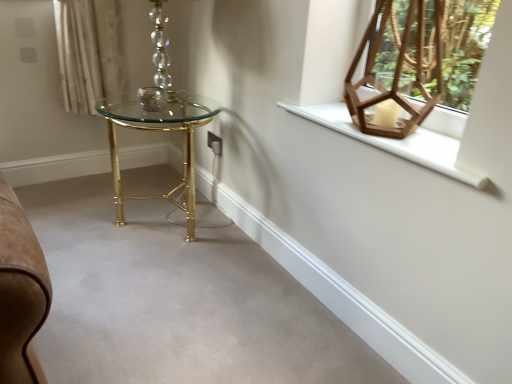
Where is `free space above white wooden window sill at upper right (from a real-world perspective)`? The image size is (512, 384). free space above white wooden window sill at upper right (from a real-world perspective) is located at coordinates (366, 127).